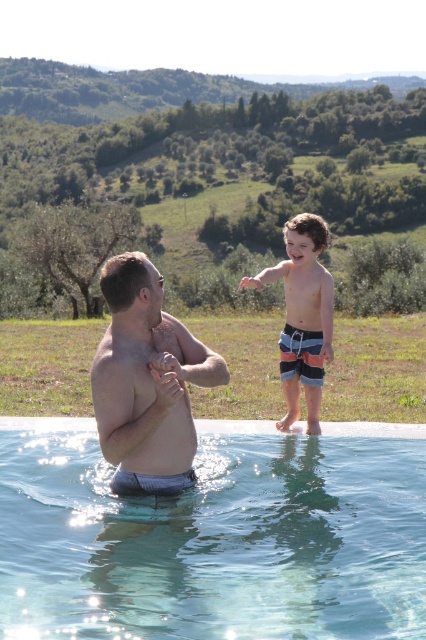
You are a photographer planning to capture a closeup shot of the striped board shorts at upper right. To ensure the clear glass water at center doesn

The clear glass water at center is larger in size than the striped board shorts at upper right, so the photographer should adjust the camera focus to prioritize the striped board shorts at upper right to avoid the larger water area overwhelming the shot.